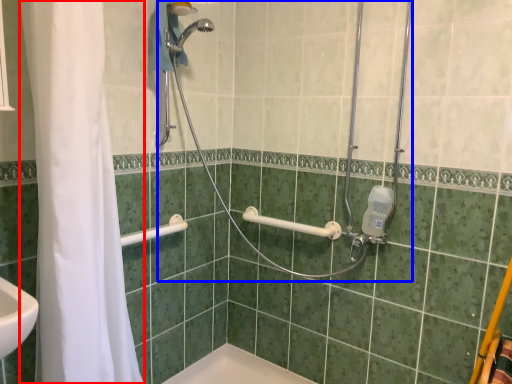
Question: Among these objects, which one is farthest to the camera, shower curtain (highlighted by a red box) or shower (highlighted by a blue box)?

Choices:
 (A) shower curtain
 (B) shower

Answer: (B)